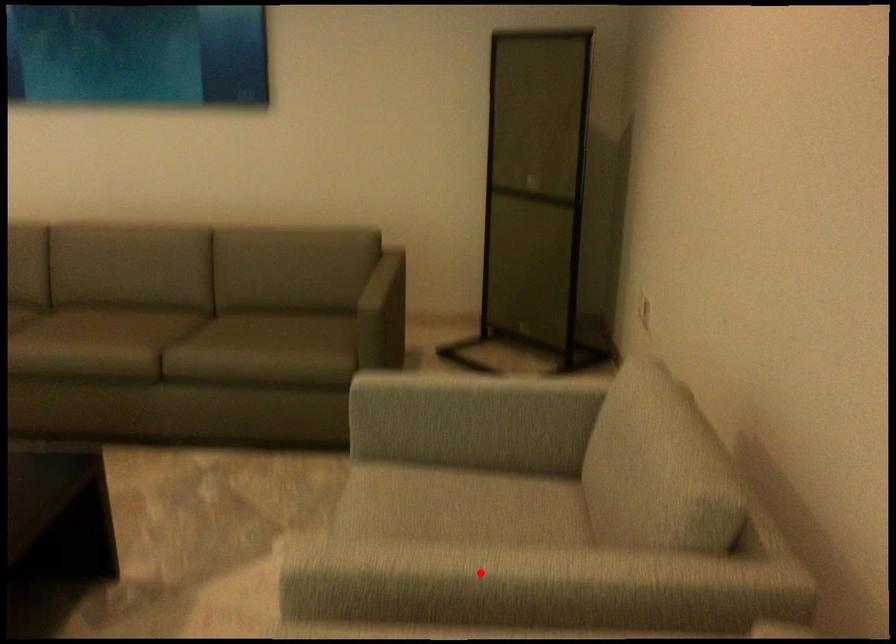
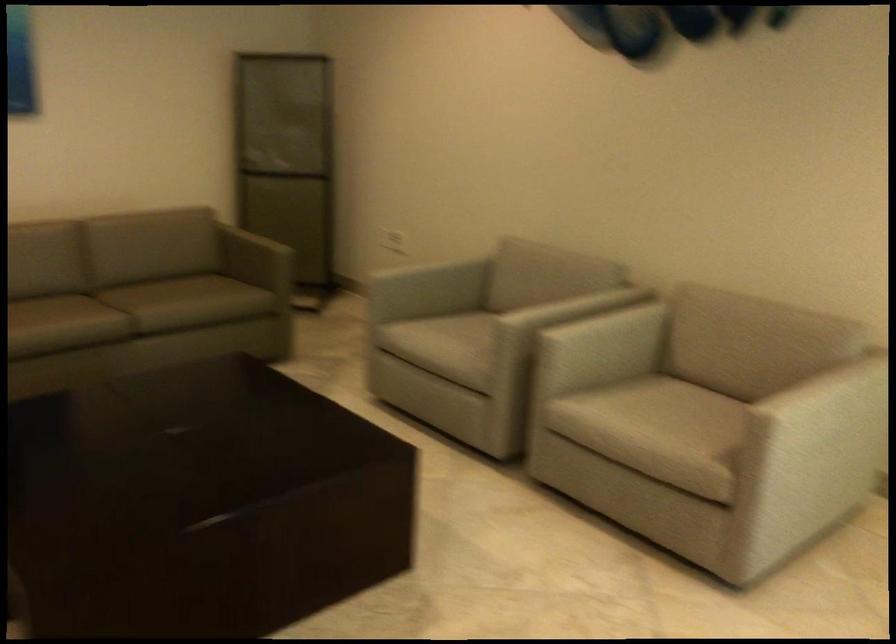
Question: A red point is marked in image1. In image2, is the corresponding 3D point closer to the camera or farther? Reply with the corresponding letter.

Choices:
 (A) The corresponding 3D point is closer.
 (B) The corresponding 3D point is farther.

Answer: (B)